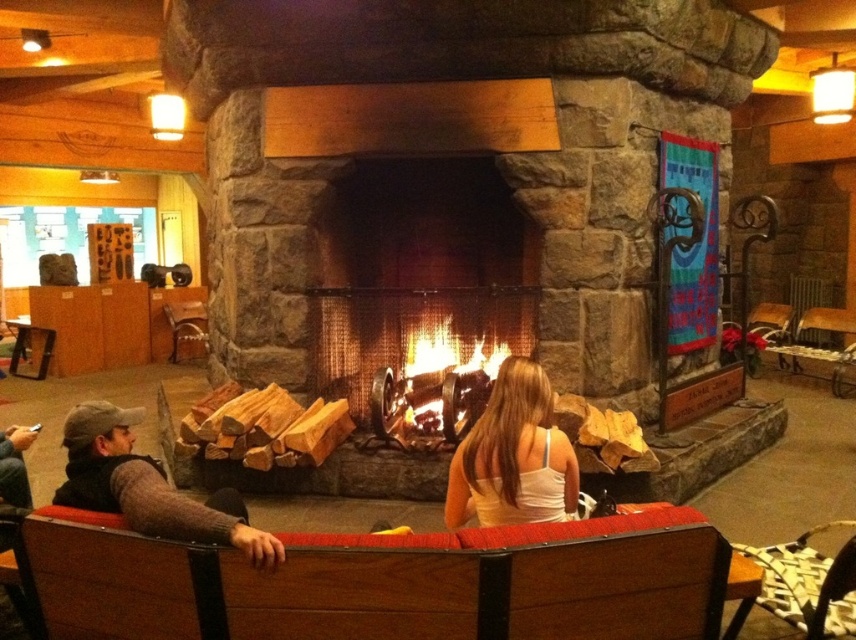
Question: Which point appears farthest from the camera in this image?

Choices:
 (A) (747, 547)
 (B) (483, 509)

Answer: (A)

Question: Is charcoal wood fire at center wider than wooden armchair at center?

Choices:
 (A) no
 (B) yes

Answer: (B)

Question: Is wooden logs at center closer to camera compared to white fabric tank top at center?

Choices:
 (A) no
 (B) yes

Answer: (A)

Question: Which point is closer to the camera?

Choices:
 (A) knit sweater at left
 (B) white fabric tank top at center
 (C) charcoal wood fire at center
 (D) wooden armchair at center

Answer: (A)

Question: Does white fabric tank top at center appear under wooden armchair at center?

Choices:
 (A) no
 (B) yes

Answer: (A)

Question: Which point appears closest to the camera in this image?

Choices:
 (A) (91, 404)
 (B) (837, 611)
 (C) (435, 433)
 (D) (520, 440)

Answer: (B)